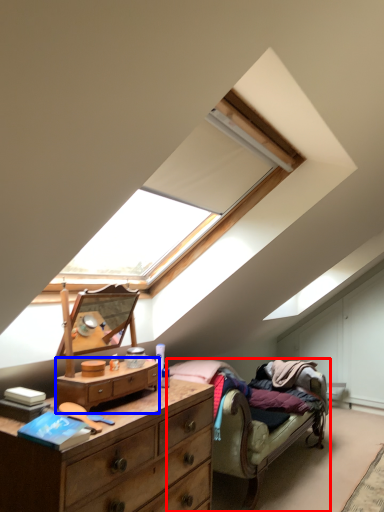
Question: Which of the following is the farthest to the observer, studio couch (highlighted by a red box) or chest of drawers (highlighted by a blue box)?

Choices:
 (A) studio couch
 (B) chest of drawers

Answer: (A)